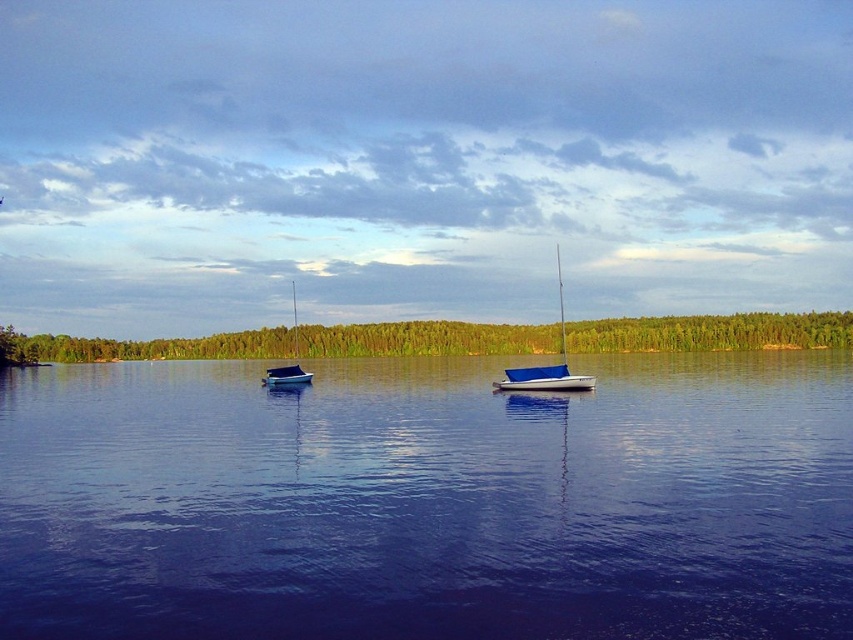
Does blue canvas sailboat at center have a lesser width compared to blue matte sailboat at center?

Yes, blue canvas sailboat at center is thinner than blue matte sailboat at center.

Is blue canvas sailboat at center taller than blue matte sailboat at center?

Yes.

The width and height of the screenshot is (853, 640). Find the location of `blue canvas sailboat at center`. blue canvas sailboat at center is located at coordinates (547, 365).

Who is lower down, blue water at center or blue canvas sailboat at center?

blue water at center is below.

Consider the image. Can you confirm if blue water at center is taller than blue canvas sailboat at center?

No.

Describe the element at coordinates (428, 500) in the screenshot. I see `blue water at center` at that location.

You are a GUI agent. You are given a task and a screenshot of the screen. Output one action in this format:
    pyautogui.click(x=<x>, y=<y>)
    Task: Click on the blue water at center
    The width and height of the screenshot is (853, 640).
    Given the screenshot: What is the action you would take?
    pyautogui.click(x=428, y=500)

What do you see at coordinates (428, 500) in the screenshot? I see `blue water at center` at bounding box center [428, 500].

Does point (631, 449) come behind point (294, 348)?

No, it is in front of (294, 348).

Is point (837, 625) closer to viewer compared to point (271, 380)?

Yes.

This screenshot has width=853, height=640. What are the coordinates of `blue water at center` in the screenshot? It's located at (428, 500).